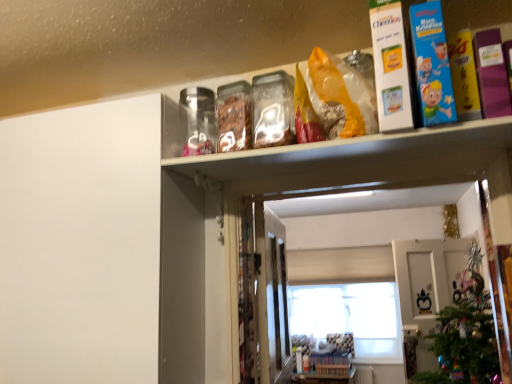
Question: Is white matte window at center situated inside blue cardboard box at upper right, acting as the 2th book starting from the left, or outside?

Choices:
 (A) outside
 (B) inside

Answer: (A)

Question: From a real-world perspective, is white matte window at center physically located above or below blue cardboard box at upper right, acting as the 2th book starting from the left?

Choices:
 (A) above
 (B) below

Answer: (B)

Question: Which object is positioned closest to the green matte christmas tree at lower right?

Choices:
 (A) clear plastic shelf at upper center
 (B) purple matte book at upper right, the 3th book when ordered from left to right
 (C) white matte window at center
 (D) white cardboard box at upper right, the first book when ordered from left to right
 (E) blue cardboard box at upper right, the second book viewed from the right

Answer: (C)

Question: Which of these objects is positioned closest to the white cardboard box at upper right, the first book when ordered from left to right?

Choices:
 (A) blue cardboard box at upper right, acting as the 2th book starting from the left
 (B) white matte window at center
 (C) clear plastic shelf at upper center
 (D) green matte christmas tree at lower right
 (E) purple matte book at upper right, the 3th book when ordered from left to right

Answer: (A)